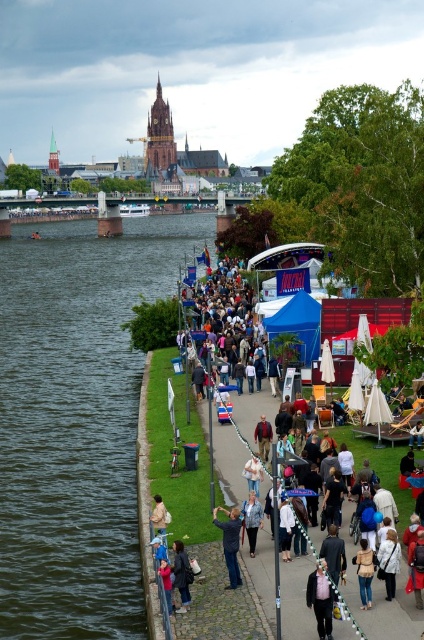
You are standing on the riverside pathway and want to reach the point marked at coordinates point (234, 580). Given that your walking speed is 1.5 meters per second, how many seconds will it take you to reach that point?

The point (234, 580) is 32.42 meters away from the viewer. At a walking speed of 1.5 meters per second, it will take approximately 21.61 seconds to reach the point.

You are standing on the riverside pathway and see two people wearing dark blue jeans at center and dark blue jeans at lower center. Which pair of jeans is closer to you?

The dark blue jeans at center is closer to you because it is further to the viewer than dark blue jeans at lower center.

You are a photographer trying to capture a candid shot of the dark blue jeans at center and the denim jacket at center. Since you want to ensure both items are in focus, you need to know their sizes relative to each other. Which object is wider?

The dark blue jeans at center is wider than the denim jacket at center.